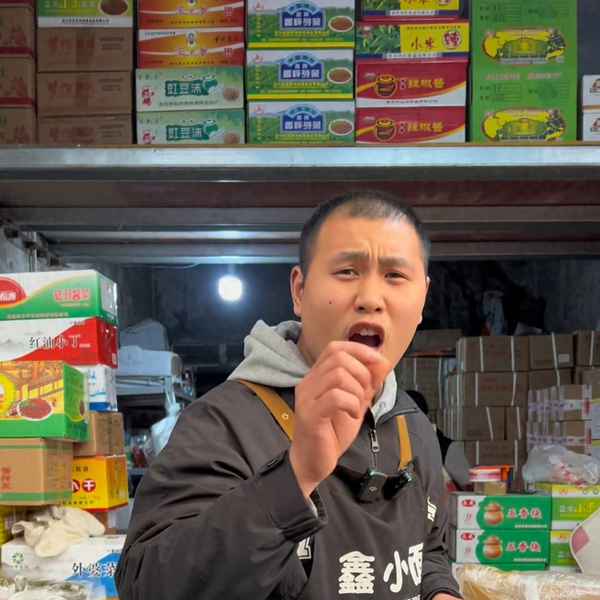
Locate an element on the screen. light is located at coordinates (232, 293).